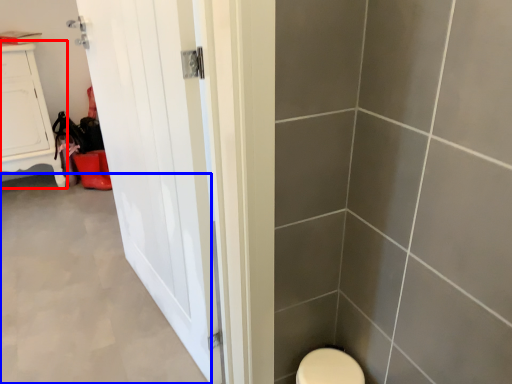
Question: Which object appears closest to the camera in this image, furniture (highlighted by a red box) or plain (highlighted by a blue box)?

Choices:
 (A) furniture
 (B) plain

Answer: (B)